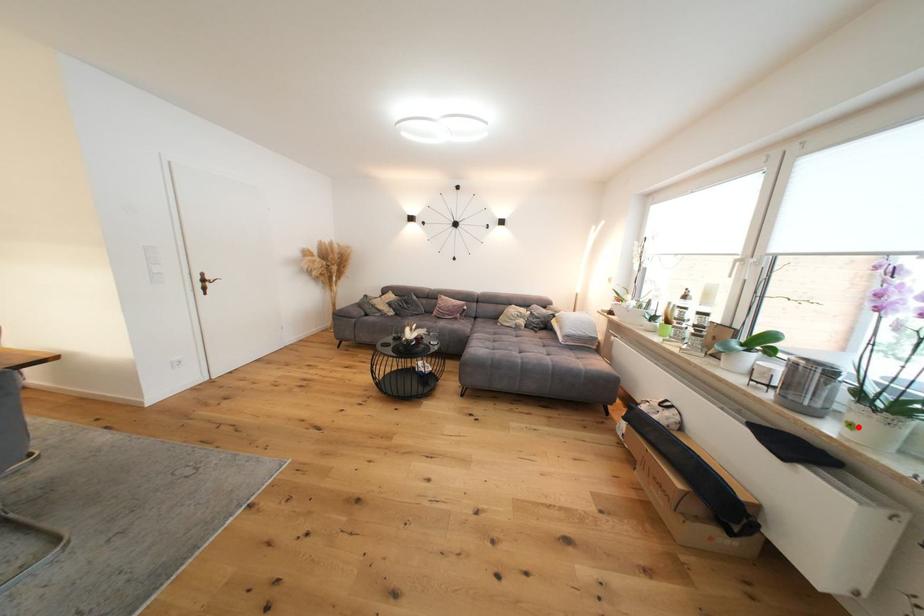
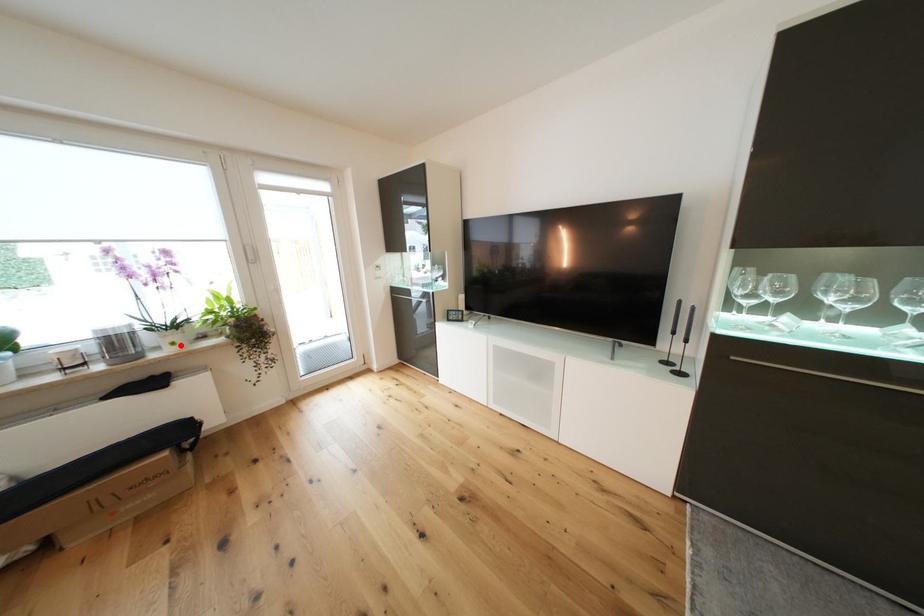
I am providing you with two images of the same scene from different viewpoints. A red point is marked on the first image and another point is marked on the second image. Is the red point in image1 aligned with the point shown in image2?

Yes